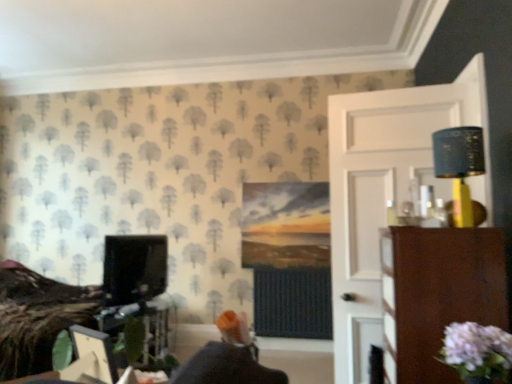
Question: From the image's perspective, is brown wood dresser at right located beneath matte black lampshade at upper right?

Choices:
 (A) yes
 (B) no

Answer: (A)

Question: Can matte black lampshade at upper right be found inside brown wood dresser at right?

Choices:
 (A) no
 (B) yes

Answer: (A)

Question: From the image's perspective, is brown wood dresser at right over matte black lampshade at upper right?

Choices:
 (A) yes
 (B) no

Answer: (B)

Question: Is brown wood dresser at right facing towards matte black lampshade at upper right?

Choices:
 (A) no
 (B) yes

Answer: (A)

Question: From a real-world perspective, is brown wood dresser at right beneath matte black lampshade at upper right?

Choices:
 (A) yes
 (B) no

Answer: (A)

Question: In the image, is matte black lampshade at upper right positioned in front of or behind matte black monitor at left?

Choices:
 (A) behind
 (B) front

Answer: (B)

Question: Considering the positions of matte black lampshade at upper right and matte black monitor at left in the image, is matte black lampshade at upper right wider or thinner than matte black monitor at left?

Choices:
 (A) wide
 (B) thin

Answer: (B)

Question: Is point (443, 142) closer or farther from the camera than point (141, 236)?

Choices:
 (A) farther
 (B) closer

Answer: (B)

Question: Based on their sizes in the image, would you say matte black lampshade at upper right is bigger or smaller than matte black monitor at left?

Choices:
 (A) small
 (B) big

Answer: (A)

Question: Do you think matte black monitor at left is within matte black lampshade at upper right, or outside of it?

Choices:
 (A) outside
 (B) inside

Answer: (A)

Question: From a real-world perspective, relative to matte black lampshade at upper right, is matte black monitor at left vertically above or below?

Choices:
 (A) above
 (B) below

Answer: (B)

Question: From the image's perspective, is matte black monitor at left located above or below matte black lampshade at upper right?

Choices:
 (A) above
 (B) below

Answer: (B)

Question: Is matte black monitor at left bigger or smaller than matte black lampshade at upper right?

Choices:
 (A) big
 (B) small

Answer: (A)

Question: Looking at the image, does matte black monitor at left seem bigger or smaller compared to pale pink fabric flower at lower right?

Choices:
 (A) big
 (B) small

Answer: (A)

Question: Looking at their shapes, would you say matte black monitor at left is wider or thinner than pale pink fabric flower at lower right?

Choices:
 (A) wide
 (B) thin

Answer: (A)